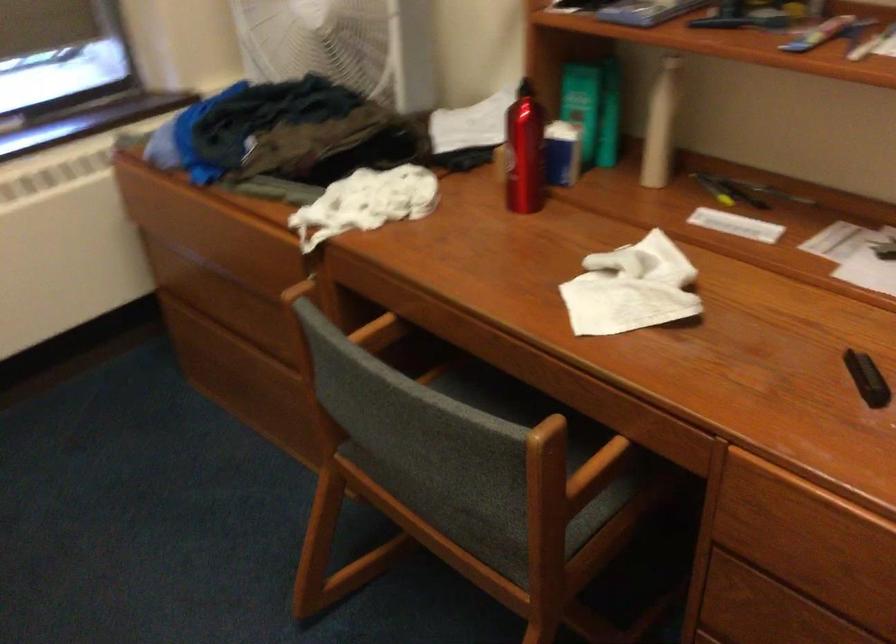
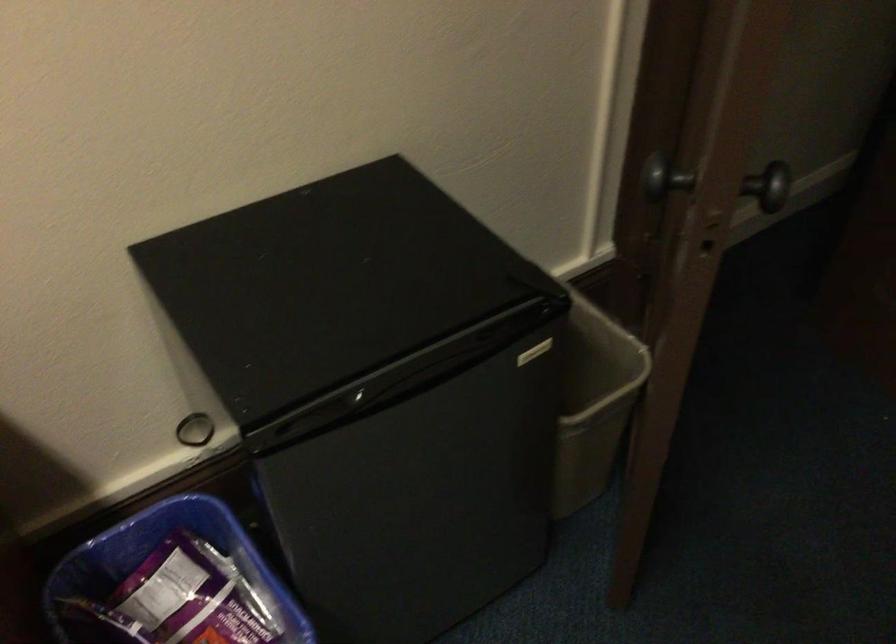
Based on the continuous images, in which direction is the camera rotating?

The camera's rotation is toward right-down.